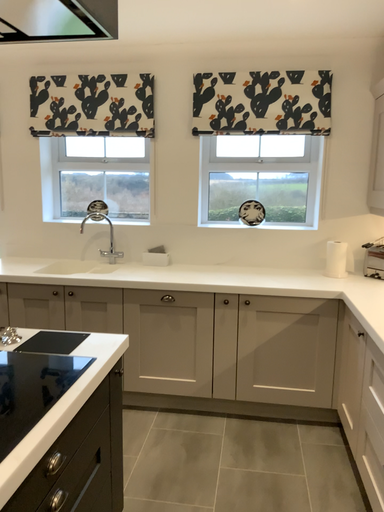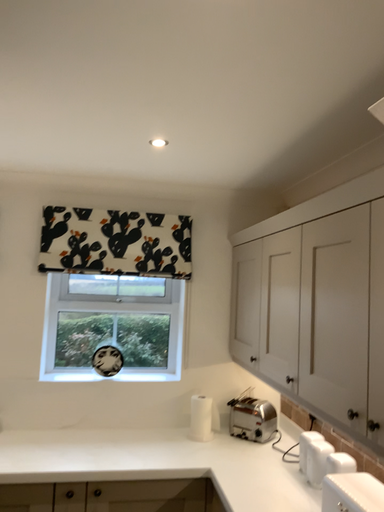
Question: How did the camera likely rotate when shooting the video?

Choices:
 (A) rotated right
 (B) rotated left

Answer: (A)